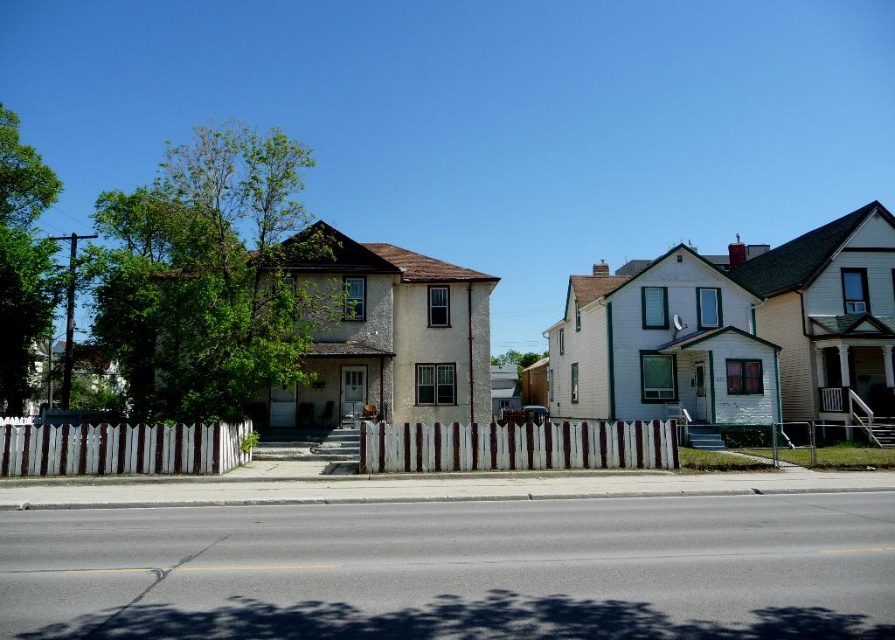
Is the position of white wood fence at center more distant than that of white picket fence at lower left?

Yes, it is behind white picket fence at lower left.

Can you confirm if white wood fence at center is wider than white picket fence at lower left?

Indeed, white wood fence at center has a greater width compared to white picket fence at lower left.

Which is behind, point (581, 422) or point (33, 428)?

Positioned behind is point (581, 422).

You are a GUI agent. You are given a task and a screenshot of the screen. Output one action in this format:
    pyautogui.click(x=<x>, y=<y>)
    Task: Click on the white wood fence at center
    Image resolution: width=895 pixels, height=640 pixels.
    Given the screenshot: What is the action you would take?
    pyautogui.click(x=517, y=445)